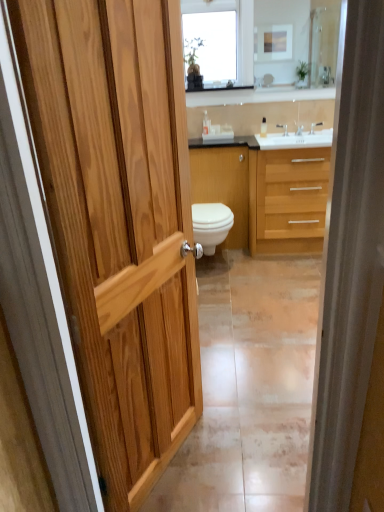
Question: Is white glossy cabinet at center taller than light wood/woodenmaterial/texture bathroom cabinet at center?

Choices:
 (A) no
 (B) yes

Answer: (B)

Question: From the image's perspective, is white glossy cabinet at center on light wood/woodenmaterial/texture bathroom cabinet at center?

Choices:
 (A) yes
 (B) no

Answer: (A)

Question: Is white glossy cabinet at center closer to the viewer compared to light wood/woodenmaterial/texture bathroom cabinet at center?

Choices:
 (A) no
 (B) yes

Answer: (A)

Question: From the image's perspective, is white glossy cabinet at center below light wood/woodenmaterial/texture bathroom cabinet at center?

Choices:
 (A) yes
 (B) no

Answer: (B)

Question: Is white glossy cabinet at center to the left of light wood/woodenmaterial/texture bathroom cabinet at center from the viewer's perspective?

Choices:
 (A) no
 (B) yes

Answer: (B)

Question: Is clear glass mirror at upper center spatially inside clear glass window at upper center, or outside of it?

Choices:
 (A) inside
 (B) outside

Answer: (B)

Question: From the image's perspective, is clear glass mirror at upper center located above or below clear glass window at upper center?

Choices:
 (A) below
 (B) above

Answer: (A)

Question: Does point (190, 9) appear closer or farther from the camera than point (220, 69)?

Choices:
 (A) farther
 (B) closer

Answer: (B)

Question: Considering the positions of clear glass mirror at upper center and clear glass window at upper center in the image, is clear glass mirror at upper center wider or thinner than clear glass window at upper center?

Choices:
 (A) thin
 (B) wide

Answer: (A)

Question: From a real-world perspective, is white glossy toilet at center above or below clear glass mirror at upper center?

Choices:
 (A) above
 (B) below

Answer: (B)

Question: Considering the relative positions of white glossy toilet at center and clear glass mirror at upper center in the image provided, is white glossy toilet at center to the left or to the right of clear glass mirror at upper center?

Choices:
 (A) right
 (B) left

Answer: (B)

Question: Is white glossy toilet at center taller or shorter than clear glass mirror at upper center?

Choices:
 (A) tall
 (B) short

Answer: (B)

Question: Considering their positions, is white glossy toilet at center located in front of or behind clear glass mirror at upper center?

Choices:
 (A) front
 (B) behind

Answer: (A)

Question: Considering the positions of point (215, 163) and point (258, 208), is point (215, 163) closer or farther from the camera than point (258, 208)?

Choices:
 (A) closer
 (B) farther

Answer: (B)

Question: Choose the correct answer: Is white glossy cabinet at center inside light wood/woodenmaterial/texture bathroom cabinet at center or outside it?

Choices:
 (A) outside
 (B) inside

Answer: (A)